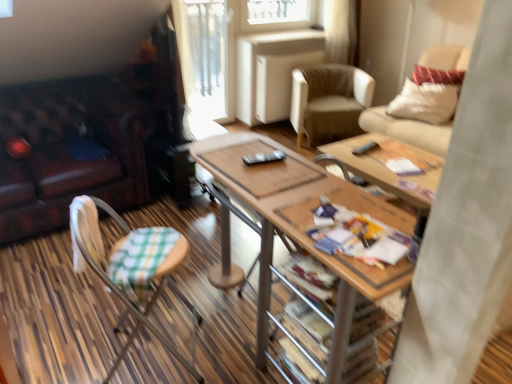
Question: From the image's perspective, does beige leather armchair at center, acting as the third chair starting from the bottom, appear lower than green checkered fabric chair at lower left, placed as the third chair when sorted from back to front?

Choices:
 (A) yes
 (B) no

Answer: (B)

Question: From a real-world perspective, is beige leather armchair at center, the third chair in the front-to-back sequence, physically above green checkered fabric chair at lower left, the third chair from the top?

Choices:
 (A) yes
 (B) no

Answer: (B)

Question: From the image's perspective, is beige leather armchair at center, placed as the first chair when sorted from back to front, over green checkered fabric chair at lower left, the 1th chair in the front-to-back sequence?

Choices:
 (A) yes
 (B) no

Answer: (A)

Question: Can you confirm if beige leather armchair at center, marked as the 1th chair in a top-to-bottom arrangement, is positioned to the right of green checkered fabric chair at lower left, the 1th chair in the front-to-back sequence?

Choices:
 (A) yes
 (B) no

Answer: (A)

Question: Considering the relative sizes of beige leather armchair at center, acting as the third chair starting from the bottom, and green checkered fabric chair at lower left, the 1th chair positioned from the bottom, in the image provided, is beige leather armchair at center, acting as the third chair starting from the bottom, thinner than green checkered fabric chair at lower left, the 1th chair positioned from the bottom,?

Choices:
 (A) yes
 (B) no

Answer: (B)

Question: From a real-world perspective, is white textured pillow at upper right above or below transparent glass door at upper center?

Choices:
 (A) above
 (B) below

Answer: (B)

Question: Considering the positions of white textured pillow at upper right and transparent glass door at upper center in the image, is white textured pillow at upper right taller or shorter than transparent glass door at upper center?

Choices:
 (A) tall
 (B) short

Answer: (B)

Question: Is white textured pillow at upper right in front of or behind transparent glass door at upper center in the image?

Choices:
 (A) front
 (B) behind

Answer: (A)

Question: From the image's perspective, is white textured pillow at upper right positioned above or below transparent glass door at upper center?

Choices:
 (A) below
 (B) above

Answer: (A)

Question: Considering their positions, is transparent glass door at upper center located in front of or behind beige fabric chair at upper right, which appears as the first chair when viewed from the right?

Choices:
 (A) behind
 (B) front

Answer: (A)

Question: Is transparent glass door at upper center wider or thinner than beige fabric chair at upper right, acting as the 2th chair starting from the front?

Choices:
 (A) thin
 (B) wide

Answer: (A)

Question: Visually, is transparent glass door at upper center positioned to the left or to the right of beige fabric chair at upper right, the 2th chair in the top-to-bottom sequence?

Choices:
 (A) left
 (B) right

Answer: (A)

Question: Do you think transparent glass door at upper center is within beige fabric chair at upper right, the 2th chair in the top-to-bottom sequence, or outside of it?

Choices:
 (A) outside
 (B) inside

Answer: (A)

Question: Is printed paper magazine at center taller or shorter than beige fabric chair at upper right, which appears as the first chair when viewed from the right?

Choices:
 (A) short
 (B) tall

Answer: (A)

Question: Is point (381, 238) positioned closer to the camera than point (419, 135)?

Choices:
 (A) farther
 (B) closer

Answer: (B)